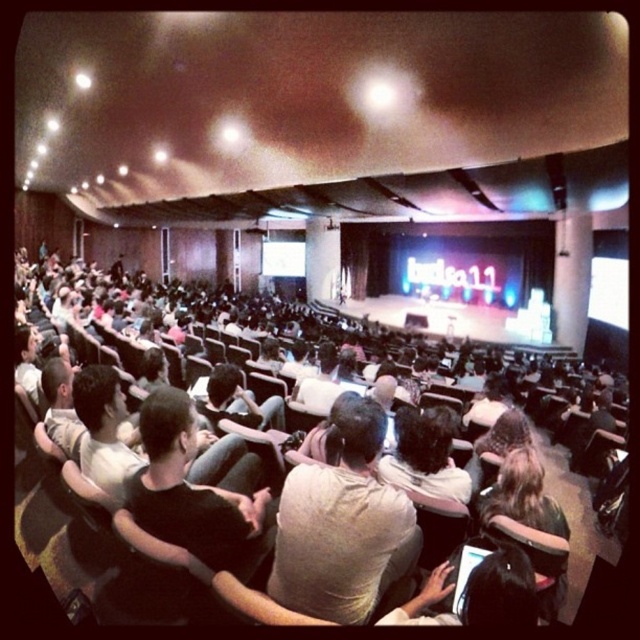
You are an event planner standing at the back of the auditorium. You notice two people at the center of the stage. One is wearing a light brown cotton shirt, and the other has light brown hair. You need to ensure there is enough space between them for a microphone stand. The stand requires at least 20 inches of space. Can you confirm if the distance between the light brown cotton shirt at center and the light brown hair at center is sufficient?

The light brown cotton shirt at center and the light brown hair at center are 23.49 inches apart, which is more than the required 20 inches. Therefore, there is sufficient space for the microphone stand between them.

You are an attendee sitting in the front row of the auditorium. You notice two features at the center of the stage area. One is the light brown cotton shirt at center and the other is the light brown hair at center. Which of these two features is taller?

The light brown cotton shirt at center has a greater height compared to the light brown hair at center, so the light brown cotton shirt at center is taller.